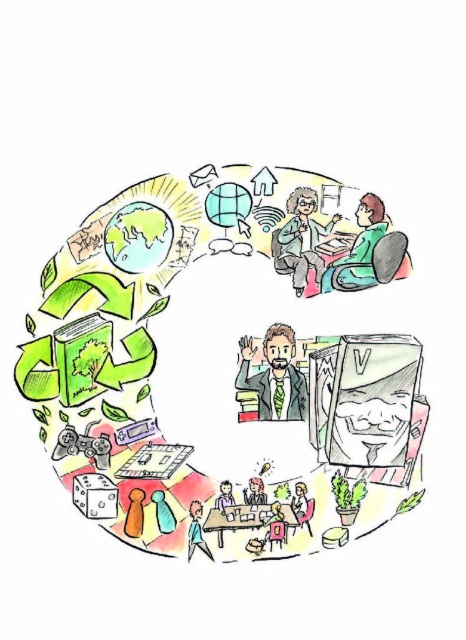
You are an observer looking at the image. There is a smooth wooden desk at center and a brown textured suit at center. Which object is positioned to the left?

The smooth wooden desk at center is to the left of the brown textured suit at center.

You are standing in front of the circular illustration and want to reach the smooth wooden desk at center to place a book. However, there is a brown textured suit at center in the way. Can you place the book on the desk without moving the suit?

The smooth wooden desk at center is closer to the viewer than the brown textured suit at center, so you can place the book on the desk without moving the suit because the desk is in front of the suit.